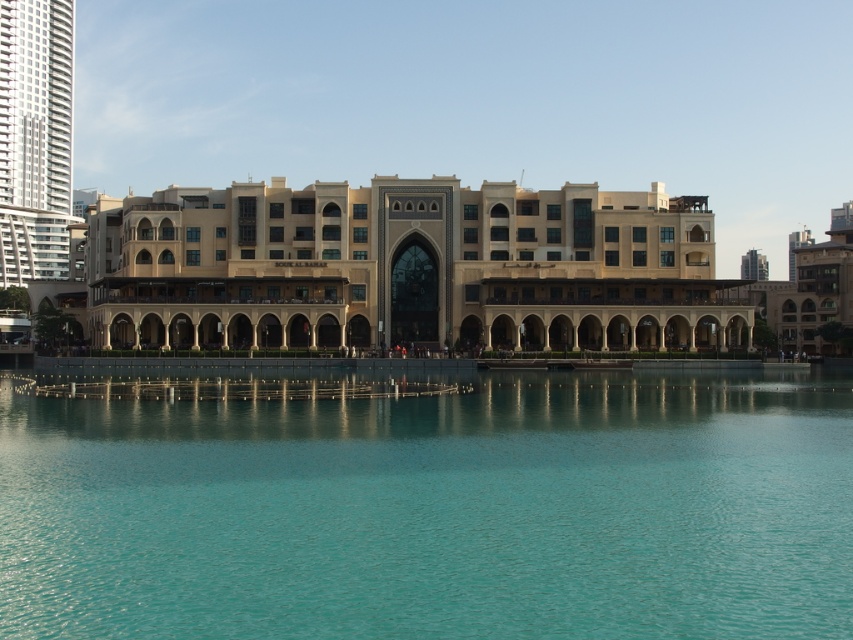
Which is behind, point (618, 289) or point (10, 129)?

Positioned behind is point (10, 129).

Can you confirm if beige stone building at center is positioned to the left of white glass skyscraper at left?

Incorrect, beige stone building at center is not on the left side of white glass skyscraper at left.

Is point (668, 332) positioned after point (62, 10)?

That is False.

Identify the location of beige stone building at center. The height and width of the screenshot is (640, 853). (408, 268).

This screenshot has width=853, height=640. I want to click on turquoise liquid at center, so 436,512.

Can you confirm if turquoise liquid at center is positioned to the left of white glass skyscraper at left?

Incorrect, turquoise liquid at center is not on the left side of white glass skyscraper at left.

Where is `turquoise liquid at center`? Image resolution: width=853 pixels, height=640 pixels. turquoise liquid at center is located at coordinates tap(436, 512).

Between point (751, 378) and point (352, 230), which one is positioned behind?

The point (352, 230) is behind.

Looking at this image, between turquoise liquid at center and beige stone building at center, which one is positioned lower?

Positioned lower is turquoise liquid at center.

In the scene shown: Who is more forward, (450, 632) or (370, 296)?

Point (450, 632)

You are a GUI agent. You are given a task and a screenshot of the screen. Output one action in this format:
    pyautogui.click(x=<x>, y=<y>)
    Task: Click on the turquoise liquid at center
    This screenshot has width=853, height=640.
    Given the screenshot: What is the action you would take?
    pyautogui.click(x=436, y=512)